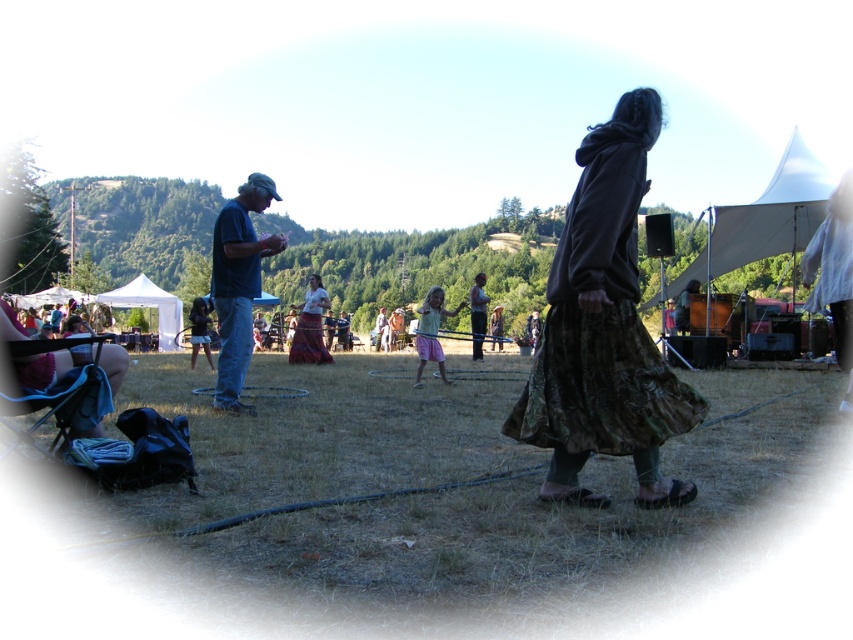
Question: Is dark brown textured coat at right bigger than multicolored fabric skirt at center?

Choices:
 (A) yes
 (B) no

Answer: (A)

Question: From the image, what is the correct spatial relationship of dark blue t-shirt at center in relation to camouflage fabric skirt at center?

Choices:
 (A) below
 (B) above

Answer: (B)

Question: Which of these objects is positioned closest to the dark blue t-shirt at center?

Choices:
 (A) pink fabric skirt at center
 (B) camouflage fabric skirt at center
 (C) dark brown textured coat at right

Answer: (A)

Question: Which point is closer to the camera?

Choices:
 (A) (428, 323)
 (B) (312, 323)
 (C) (688, 419)

Answer: (C)

Question: Is dark brown textured coat at right closer to the viewer compared to multicolored fabric skirt at center?

Choices:
 (A) no
 (B) yes

Answer: (B)

Question: Which point is farther from the camera taking this photo?

Choices:
 (A) (657, 380)
 (B) (479, 280)
 (C) (445, 314)
 (D) (256, 285)

Answer: (B)